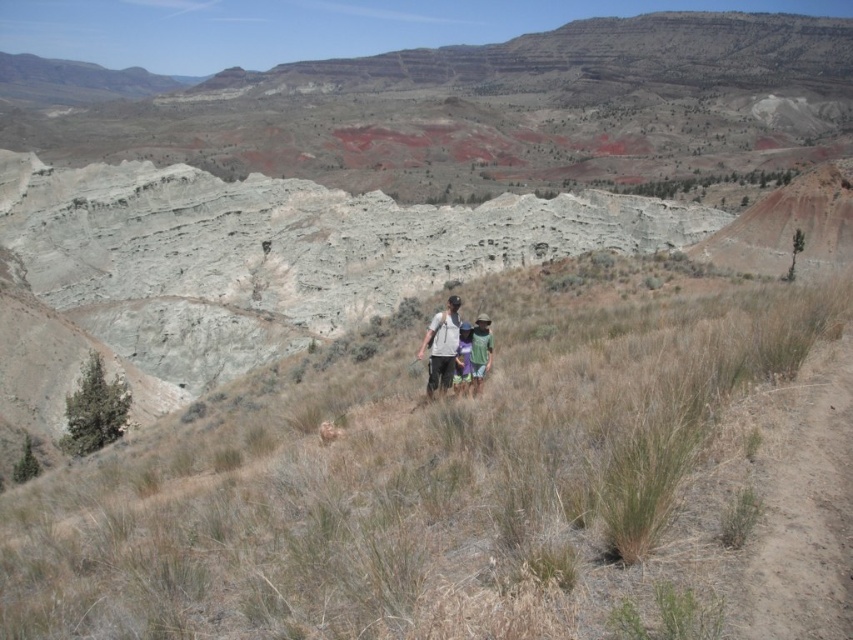
You are a drone operator tasked with capturing aerial footage of the hiking group. You need to fly the drone from point A to point B, which are marked as point (463, 449) and point (476, 337) in the image. Which point should you start your flight from to ensure the drone is closer to the hikers initially?

You should start the flight from point (463, 449) because it is closer to the viewer than point (476, 337), ensuring the drone begins near the hikers.